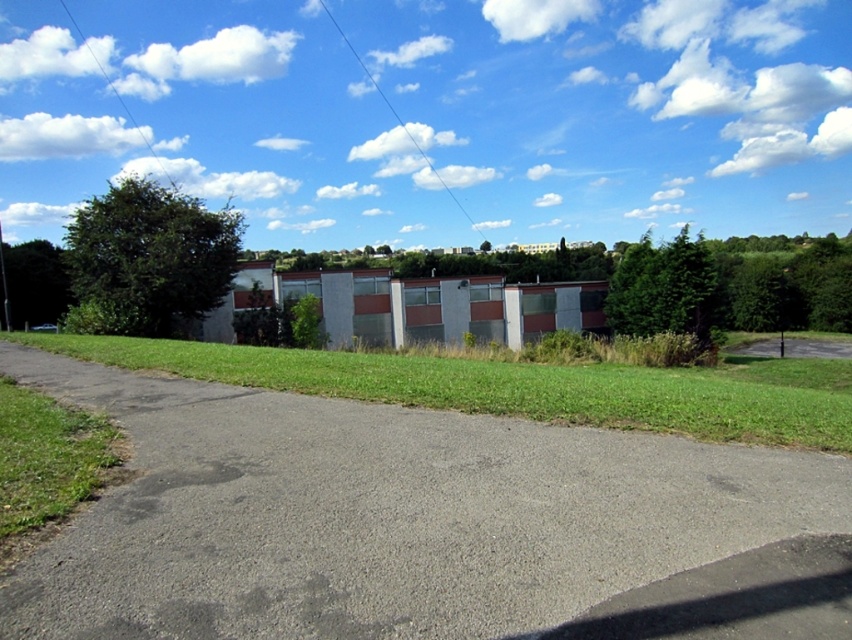
You are a gardener planning to mow the lawn. You see the green grass at lower center and the green asphalt driveway at lower right. Which area requires mowing?

The green grass at lower center requires mowing because it is a larger area compared to the green asphalt driveway at lower right.

You are a gardener planning to mow the lawn. You see the green grass at lower center and the green asphalt driveway at lower right. Which area should you avoid mowing?

You should avoid mowing the green asphalt driveway at lower right because it is an asphalt surface and not actual grass, while the green grass at lower center is the area meant for mowing.

You are driving a delivery van that is 2.5 meters wide. You need to navigate through the gray asphalt driveway at center while avoiding the green leafy tree at upper left. Can your van fit through the driveway without hitting the tree?

The gray asphalt driveway at center has a lesser width compared to green leafy tree at upper left. Since the driveway is narrower than the tree, the van may not have enough space to pass safely. However, the description does not specify the exact width of the driveway, so it is uncertain whether the van can fit without hitting the tree.